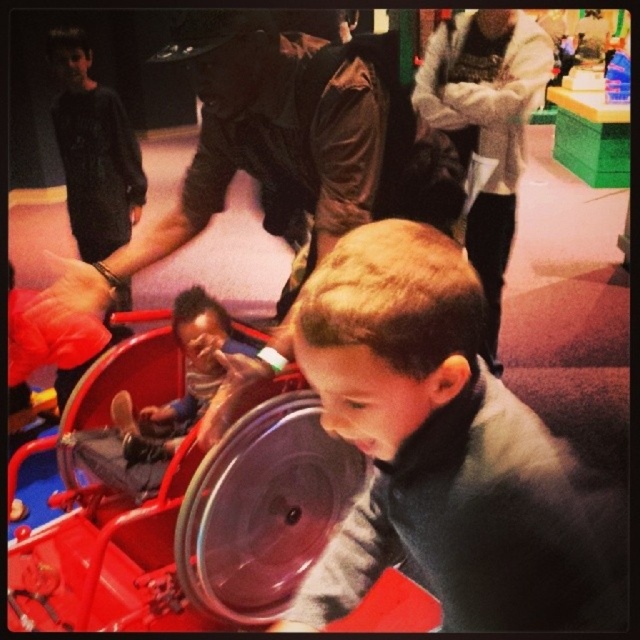
Does smooth gray sweater at center lie behind brown leather jacket at upper center?

No, it is in front of brown leather jacket at upper center.

Between point (428, 339) and point (301, 99), which one is positioned in front?

Point (428, 339) is more forward.

Where is `smooth gray sweater at center`? smooth gray sweater at center is located at coordinates (440, 448).

Is white fleece jacket at upper center above smooth plastic toy at center?

Indeed, white fleece jacket at upper center is positioned over smooth plastic toy at center.

Is white fleece jacket at upper center to the right of smooth plastic toy at center from the viewer's perspective?

Yes, white fleece jacket at upper center is to the right of smooth plastic toy at center.

What do you see at coordinates (484, 124) in the screenshot?
I see `white fleece jacket at upper center` at bounding box center [484, 124].

At what (x,y) coordinates should I click in order to perform the action: click on white fleece jacket at upper center. Please return your answer as a coordinate pair (x, y). This screenshot has width=640, height=640. Looking at the image, I should click on (484, 124).

Based on the photo, who is positioned more to the right, smooth gray sweater at center or smooth plastic toy at center?

smooth gray sweater at center

Which is behind, point (545, 524) or point (216, 323)?

Positioned behind is point (216, 323).

Who is more distant from viewer, (508,401) or (209,371)?

The point (209,371) is behind.

Image resolution: width=640 pixels, height=640 pixels. I want to click on smooth gray sweater at center, so click(440, 448).